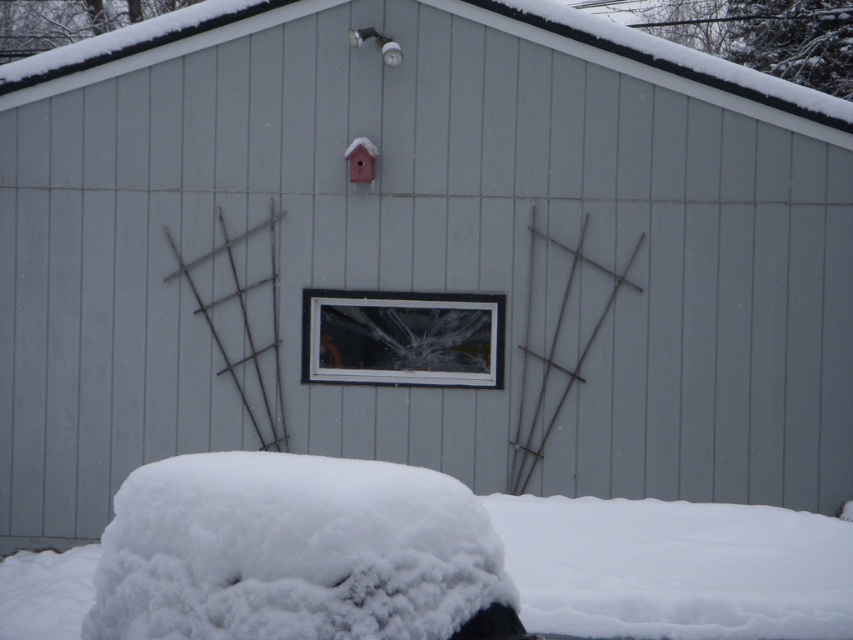
Question: Does white fluffy snow at lower center appear on the right side of clear glass window at center?

Choices:
 (A) yes
 (B) no

Answer: (B)

Question: Among these objects, which one is farthest from the camera?

Choices:
 (A) clear glass window at center
 (B) white fluffy snow at lower center

Answer: (A)

Question: Which point is farther to the camera?

Choices:
 (A) clear glass window at center
 (B) white fluffy snow at lower center

Answer: (A)

Question: Can you confirm if white fluffy snow at lower center is positioned below clear glass window at center?

Choices:
 (A) no
 (B) yes

Answer: (B)

Question: Considering the relative positions of white fluffy snow at lower center and clear glass window at center in the image provided, where is white fluffy snow at lower center located with respect to clear glass window at center?

Choices:
 (A) above
 (B) below

Answer: (B)

Question: Which object appears farthest from the camera in this image?

Choices:
 (A) white fluffy snow at lower center
 (B) clear glass window at center

Answer: (B)